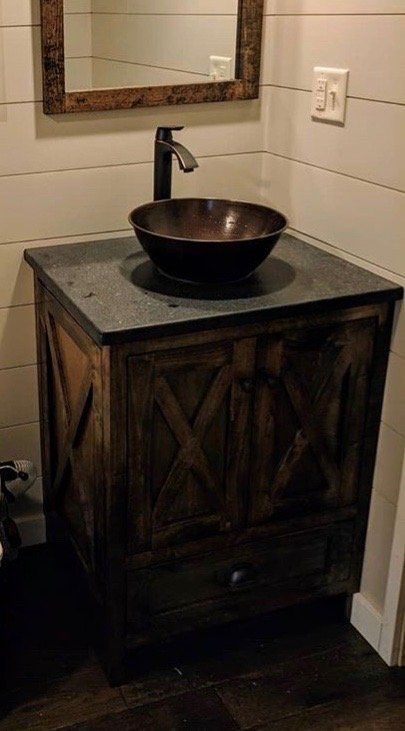
Where is `mirror`? This screenshot has width=405, height=731. mirror is located at coordinates (149, 28).